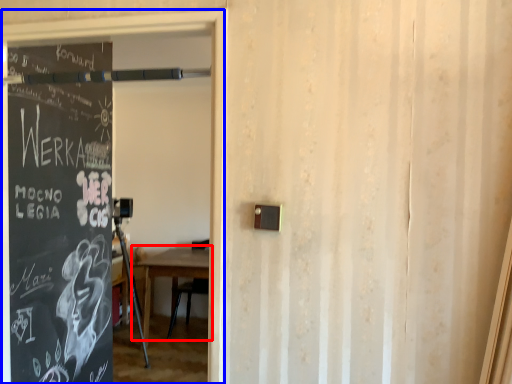
Question: Which object appears farthest to the camera in this image, table (highlighted by a red box) or garage door (highlighted by a blue box)?

Choices:
 (A) table
 (B) garage door

Answer: (A)